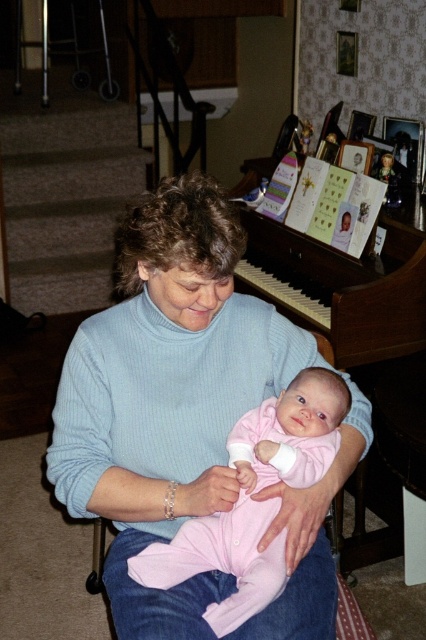
Consider the image. Please provide the 2D coordinates of the light blue sweater at center in the image. The coordinates should be in the format of a point with two decimal places, such as 0.5,0.5.

The 2D coordinates of the light blue sweater at center are at point (x=166, y=394).

You are a photographer setting up for a family portrait. You need to position the light blue sweater at center and the wooden piano at upper center so that the piano is visible in the background. Is the current arrangement suitable for this setup?

The light blue sweater at center is closer to the viewer than the wooden piano at upper center, so the current arrangement is suitable because the piano will naturally appear in the background behind the sweater.

In the scene, you see a light blue sweater at center and a wooden piano at upper center. Which object is positioned to the left when viewed from the front?

The light blue sweater at center is positioned to the left of the wooden piano at upper center.